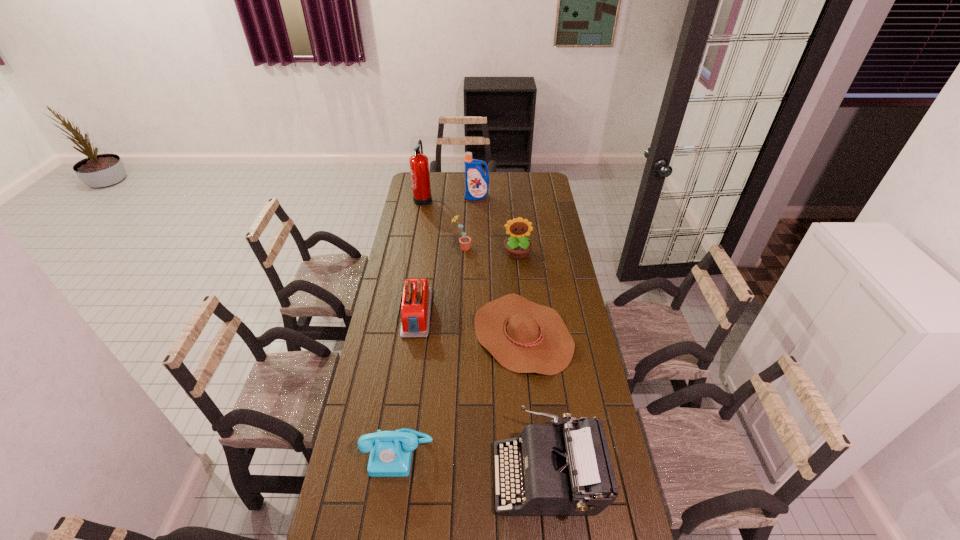
The image size is (960, 540). Find the location of `empty space between the toaster and the shortest object`. empty space between the toaster and the shortest object is located at coordinates (469, 323).

Where is `vacant space that is in between the cowboy hat and the fire extinguisher`? The width and height of the screenshot is (960, 540). vacant space that is in between the cowboy hat and the fire extinguisher is located at coordinates (473, 266).

At what (x,y) coordinates should I click in order to perform the action: click on vacant space that's between the fire extinguisher and the toaster. Please return your answer as a coordinate pair (x, y). The height and width of the screenshot is (540, 960). Looking at the image, I should click on (420, 255).

Where is `empty space between the cowboy hat and the toaster`? The width and height of the screenshot is (960, 540). empty space between the cowboy hat and the toaster is located at coordinates (469, 323).

Where is `free space between the toaster and the shortest object`? Image resolution: width=960 pixels, height=540 pixels. free space between the toaster and the shortest object is located at coordinates (469, 323).

This screenshot has height=540, width=960. I want to click on free space between the telephone and the seventh shortest object, so click(x=438, y=325).

Locate an element on the screen. free point between the second tallest object and the left sunflower is located at coordinates (469, 222).

Select which object is the fifth closest to the right sunflower. Please provide its 2D coordinates. Your answer should be formatted as a tuple, i.e. [(x, y)], where the tuple contains the x and y coordinates of a point satisfying the conditions above.

[(419, 166)]

At what (x,y) coordinates should I click in order to perform the action: click on object that ranks as the second closest to the seventh shortest object. Please return your answer as a coordinate pair (x, y). This screenshot has width=960, height=540. Looking at the image, I should click on (464, 241).

Find the location of `vacant space that satisfies the following two spatial constraints: 1. on the front side of the toaster; 2. on the left side of the cowboy hat`. vacant space that satisfies the following two spatial constraints: 1. on the front side of the toaster; 2. on the left side of the cowboy hat is located at coordinates tap(414, 334).